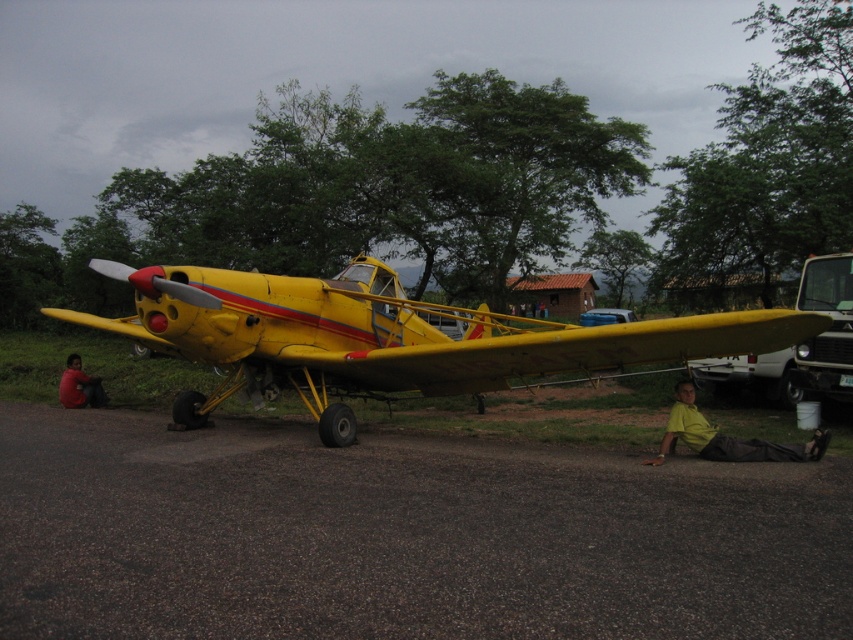
You are standing in front of the yellow aircraft and see two shirts, the yellow cotton shirt at lower right and the dark red shirt at lower left. Which shirt is nearer to you?

The yellow cotton shirt at lower right is closer to the viewer than the dark red shirt at lower left, so the yellow cotton shirt at lower right is nearer to you.

You are standing in front of the yellow aircraft and want to determine the distance between two points marked on the plane. The points are labeled as point 1 at coordinate point (x=157, y=273) and point 2 at coordinate point (x=682, y=401). Given that point 1 is closer to you than point 2, can you estimate which point is physically higher on the aircraft?

Point 1 at coordinate point (x=157, y=273) is closer to you than point 2 at coordinate point (x=682, y=401). Since point 1 is closer, it is likely positioned higher on the aircraft compared to point 2, which is further away.

You are a photographer trying to capture the yellow matte airplane at center and the dark red shirt at lower left in a single frame. Based on their sizes in the image, which object would appear bigger in your photo?

The yellow matte airplane at center would appear bigger in the photo since it has a larger size compared to the dark red shirt at lower left as stated in the description.